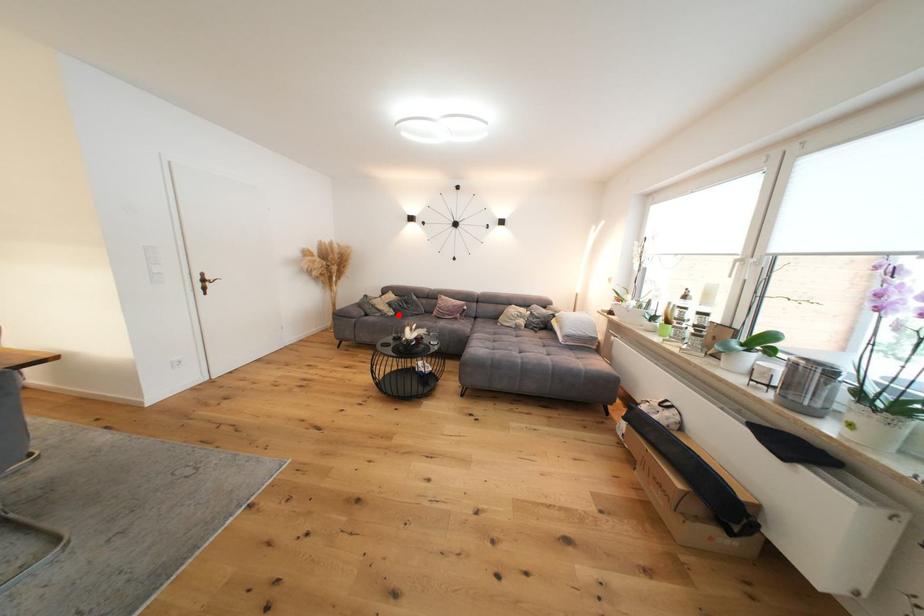
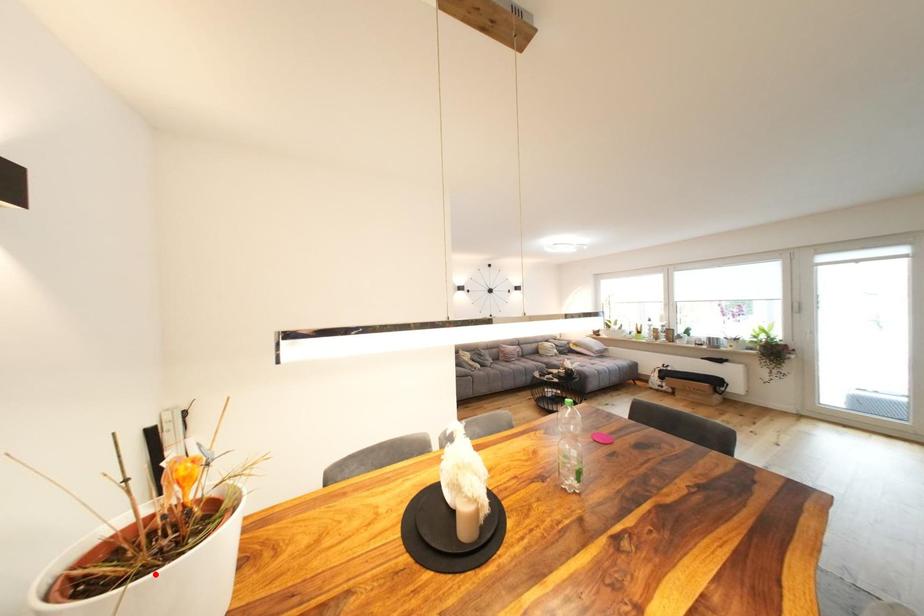
I am providing you with two images of the same scene from different viewpoints. A red point is marked on the first image and another point is marked on the second image. Is the marked point in image1 the same physical position as the marked point in image2?

No